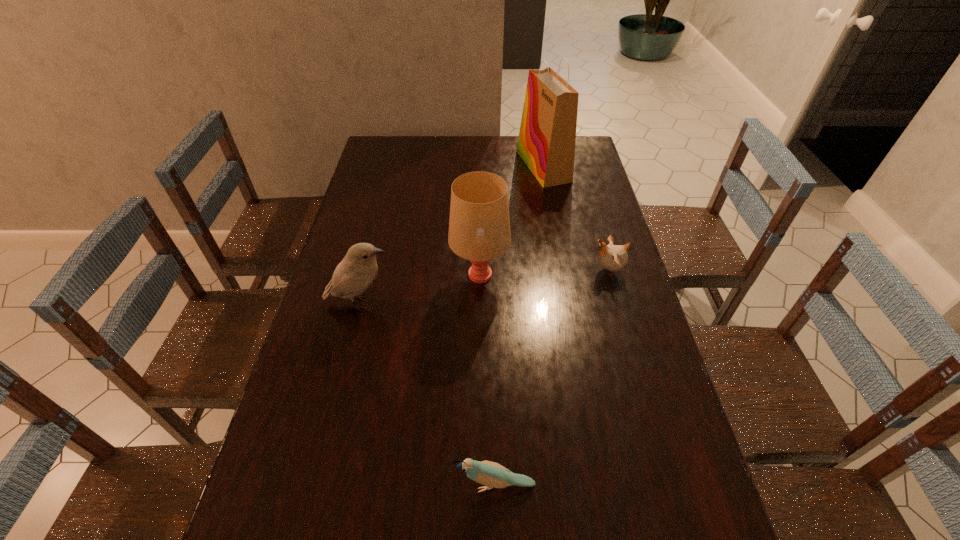
Identify the location of the third closest object to the second tallest object. (546, 143).

The height and width of the screenshot is (540, 960). Identify the location of the second closest object to the nearest bird. (479, 225).

Identify the location of the second closest bird relative to the tallest object. The height and width of the screenshot is (540, 960). (355, 273).

Locate an element on the screen. This screenshot has height=540, width=960. the closest bird relative to the farthest bird is located at coordinates tap(490, 474).

Locate an element on the screen. free space that satisfies the following two spatial constraints: 1. on the front side of the tallest object; 2. at the beak of the third tallest object is located at coordinates (568, 303).

Identify the location of vacant point that satisfies the following two spatial constraints: 1. on the front side of the lampshade; 2. at the beak of the leftmost object. The height and width of the screenshot is (540, 960). (480, 303).